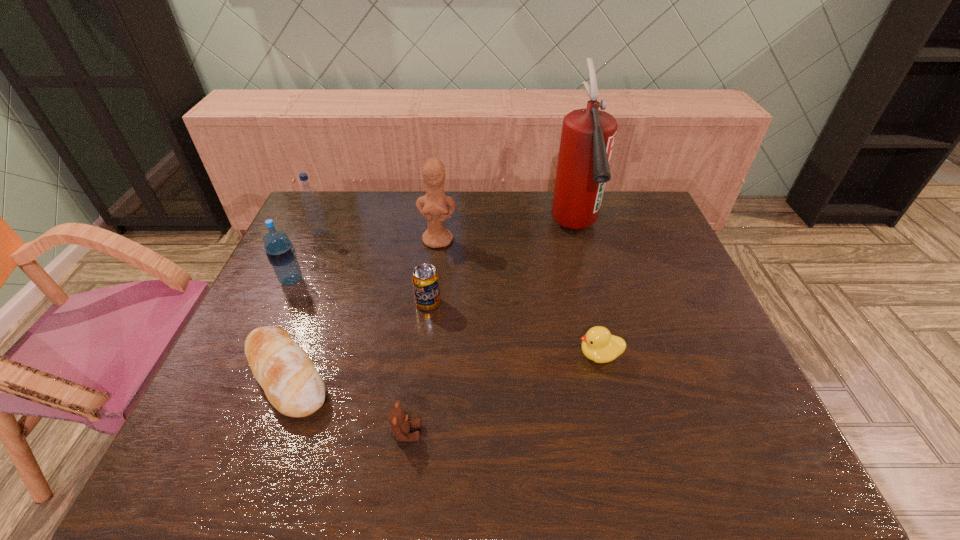
Where is `the tallest object`? The width and height of the screenshot is (960, 540). the tallest object is located at coordinates (588, 135).

This screenshot has width=960, height=540. I want to click on figurine, so click(433, 206).

This screenshot has height=540, width=960. In order to click on the farther water bottle in this screenshot , I will do `click(310, 199)`.

I want to click on the nearer water bottle, so coord(280,251).

Where is `the fifth tallest object`? Image resolution: width=960 pixels, height=540 pixels. the fifth tallest object is located at coordinates tap(425, 279).

The width and height of the screenshot is (960, 540). I want to click on soda can, so click(425, 279).

Where is `duckling`? Image resolution: width=960 pixels, height=540 pixels. duckling is located at coordinates (598, 345).

I want to click on bread, so click(292, 384).

The width and height of the screenshot is (960, 540). What are the coordinates of `teddy bear` in the screenshot? It's located at (400, 423).

The height and width of the screenshot is (540, 960). What are the coordinates of `free spot located at the nozzle of the fire extinguisher` in the screenshot? It's located at (612, 375).